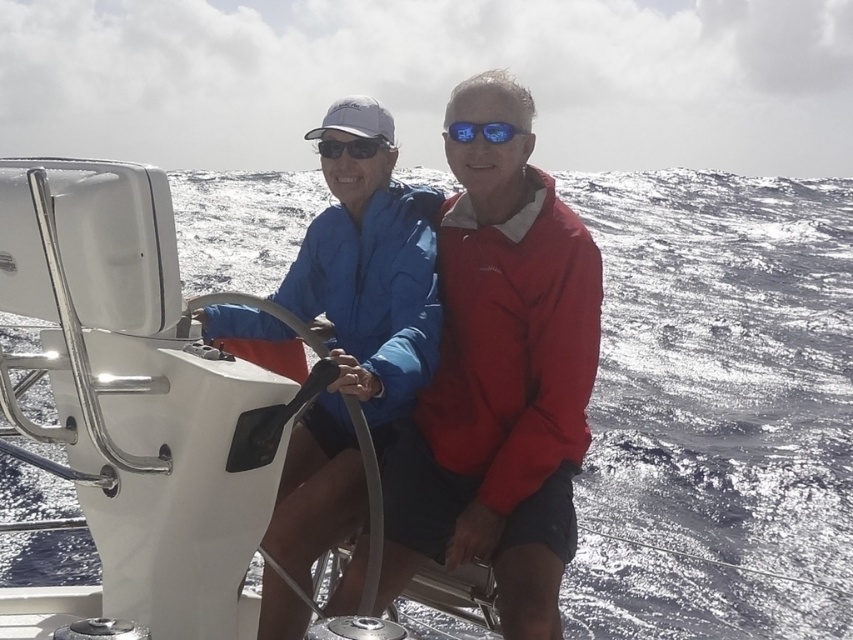
Is glistening water at steering wheel left shorter than blue reflective lenses at center?

In fact, glistening water at steering wheel left may be taller than blue reflective lenses at center.

Who is more distant from viewer, (299, 241) or (485, 134)?

The point (299, 241) is behind.

Describe the element at coordinates (717, 410) in the screenshot. The image size is (853, 640). I see `glistening water at steering wheel left` at that location.

Find the location of `glistening water at steering wheel left`. glistening water at steering wheel left is located at coordinates (717, 410).

The width and height of the screenshot is (853, 640). What are the coordinates of `glistening water at steering wheel left` in the screenshot? It's located at (717, 410).

Is the position of glistening water at steering wheel left more distant than that of matte black sunglasses at center?

No, it is not.

Which is in front, point (16, 552) or point (328, 145)?

Positioned in front is point (328, 145).

Locate an element on the screen. Image resolution: width=853 pixels, height=640 pixels. glistening water at steering wheel left is located at coordinates (717, 410).

Is blue reflective lenses at center further to the viewer compared to matte black sunglasses at center?

No, it is in front of matte black sunglasses at center.

How much distance is there between blue reflective lenses at center and matte black sunglasses at center?

blue reflective lenses at center and matte black sunglasses at center are 27.23 inches apart from each other.

Does point (502, 141) come farther from viewer compared to point (366, 152)?

That is False.

Identify the location of blue reflective lenses at center. The height and width of the screenshot is (640, 853). (482, 131).